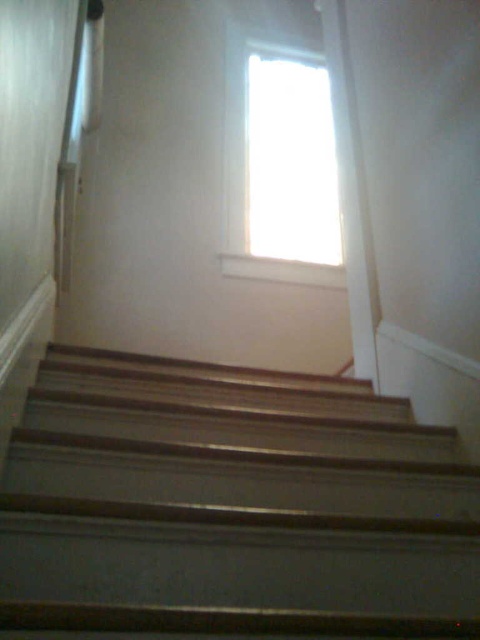
You are standing at the bottom of the wooden stairs at center and want to look up towards the transparent glass window at upper center. In which direction should you turn your head?

You should turn your head to the right because the wooden stairs at center are to the left of the transparent glass window at upper center, so the window is located to the right side of the stairs.